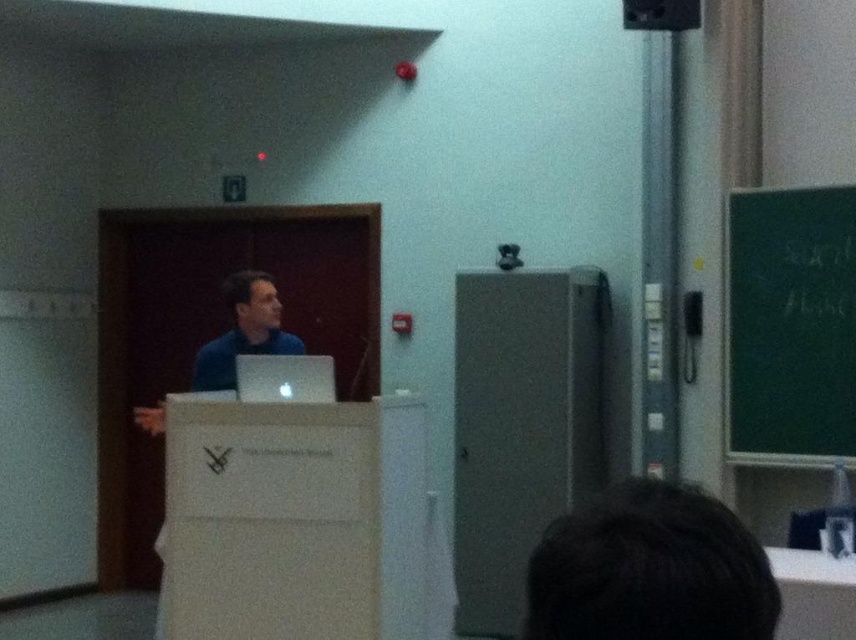
Question: Can you confirm if green chalkboard at upper right is thinner than dark brown hair at lower center?

Choices:
 (A) no
 (B) yes

Answer: (A)

Question: Among these objects, which one is nearest to the camera?

Choices:
 (A) green chalkboard at upper right
 (B) dark brown hair at lower center

Answer: (B)

Question: Considering the relative positions of green chalkboard at upper right and dark brown hair at lower center in the image provided, where is green chalkboard at upper right located with respect to dark brown hair at lower center?

Choices:
 (A) right
 (B) left

Answer: (A)

Question: Which of the following is the farthest from the observer?

Choices:
 (A) green chalkboard at upper right
 (B) dark brown hair at lower center

Answer: (A)

Question: Is green chalkboard at upper right above dark brown hair at lower center?

Choices:
 (A) yes
 (B) no

Answer: (A)

Question: Among these objects, which one is farthest from the camera?

Choices:
 (A) green chalkboard at upper right
 (B) dark brown hair at lower center

Answer: (A)